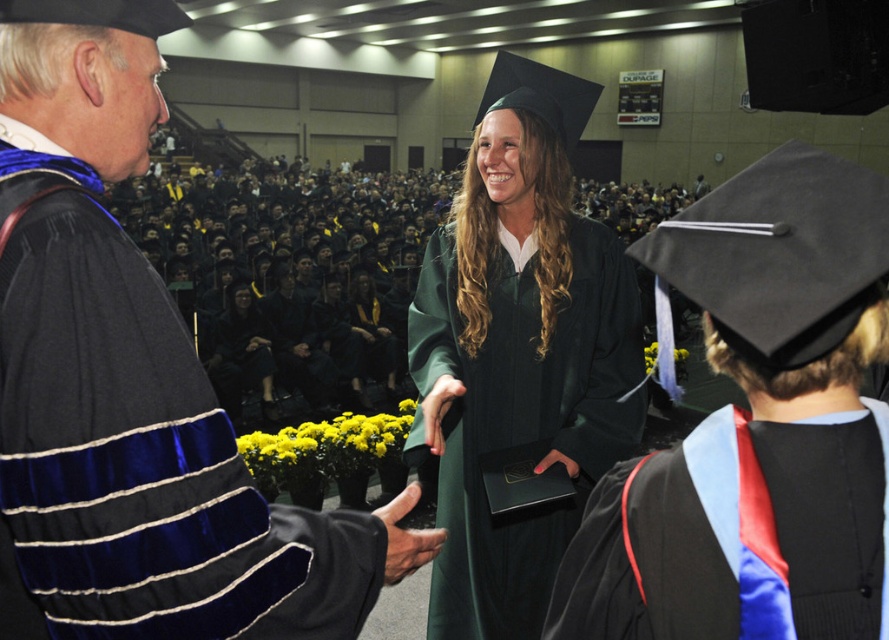
Looking at this image, you are standing at the entrance of the graduation hall and want to take a photo of the green matte graduation gown at center. The hall has a grid system where each coordinate point is marked. Can you confirm if the gown is positioned at point [519,352]?

Yes, the green matte graduation gown at center is located at point [519,352] according to the grid system.

You are a photographer standing at the back of the hall. You want to take a photo that includes both the green matte graduation gown at center and the black satin sash at center. The camera has a minimum focus distance of 3 feet. Will both subjects be in focus?

The green matte graduation gown at center is 3.62 feet away from the black satin sash at center. Since the camera requires a minimum focus distance of 3 feet, the distance between them meets the requirement. Therefore, both subjects will be in focus.